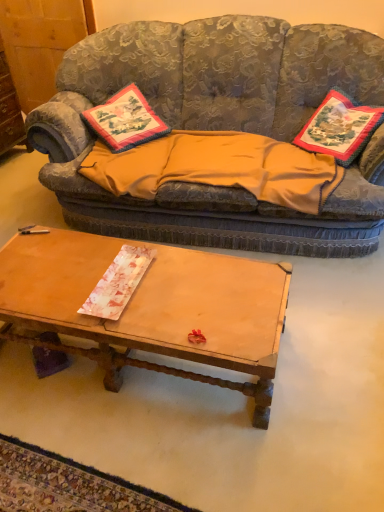
Where is `spots to the right of wooden coffee table at center`? This screenshot has height=512, width=384. spots to the right of wooden coffee table at center is located at coordinates (326, 358).